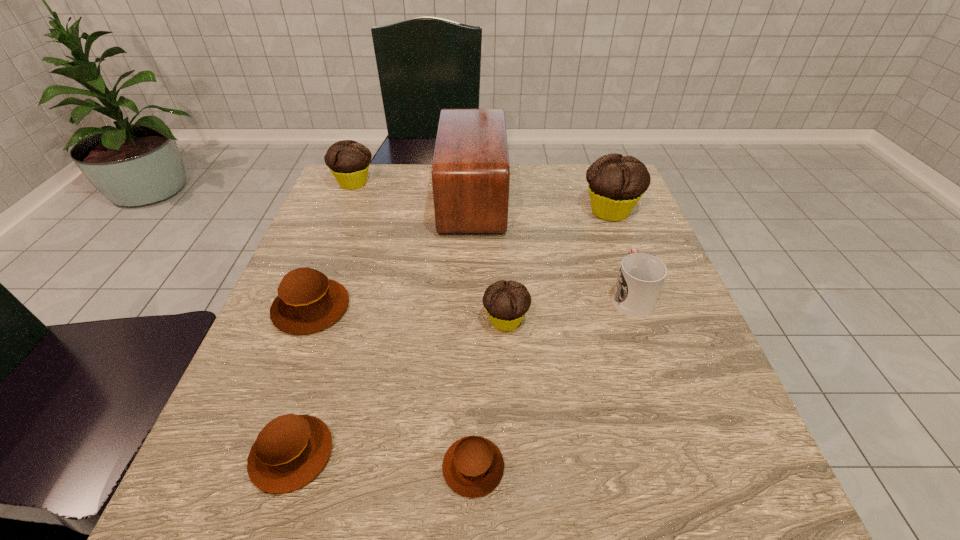
I want to click on the second smallest brown muffin, so click(x=290, y=451).

Find the location of a particular element. The width and height of the screenshot is (960, 540). the shortest muffin is located at coordinates (473, 466).

What are the coordinates of `the smallest brown muffin` in the screenshot? It's located at (473, 466).

The width and height of the screenshot is (960, 540). Find the location of `vacant space located on the front panel of the radio receiver`. vacant space located on the front panel of the radio receiver is located at coordinates (626, 198).

Locate an element on the screen. vacant point located on the left of the tallest muffin is located at coordinates (454, 211).

This screenshot has width=960, height=540. Identify the location of vacant region located 0.240m on the front of the fifth shortest muffin. (326, 252).

At what (x,y) coordinates should I click in order to perform the action: click on free region located 0.280m on the side of the red cup where the handle is located. Please return your answer as a coordinate pair (x, y). This screenshot has width=960, height=540. Looking at the image, I should click on pos(598,203).

This screenshot has height=540, width=960. Identify the location of free region located on the side of the red cup where the handle is located. (601, 212).

At what (x,y) coordinates should I click in order to perform the action: click on free space located on the side of the red cup where the handle is located. Please return your answer as a coordinate pair (x, y). The height and width of the screenshot is (540, 960). Looking at the image, I should click on (612, 244).

Find the location of `vacant space located 0.170m on the front of the biggest brown muffin`. vacant space located 0.170m on the front of the biggest brown muffin is located at coordinates (268, 421).